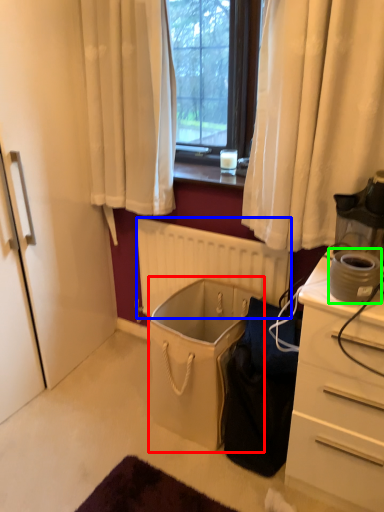
Question: Which object is positioned farthest from laundry basket (highlighted by a red box)? Select from radiator (highlighted by a blue box) and appliance (highlighted by a green box).

Choices:
 (A) radiator
 (B) appliance

Answer: (B)